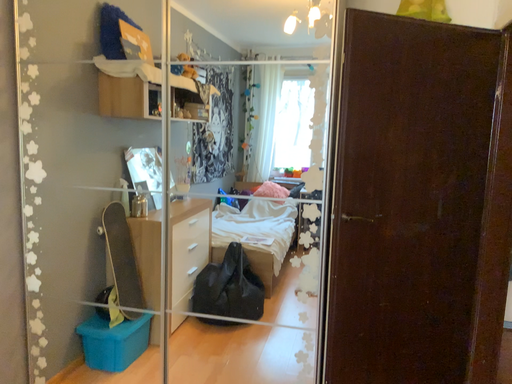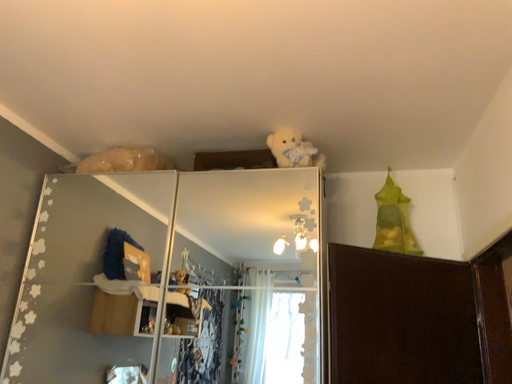
Question: How did the camera likely rotate when shooting the video?

Choices:
 (A) rotated upward
 (B) rotated downward

Answer: (A)